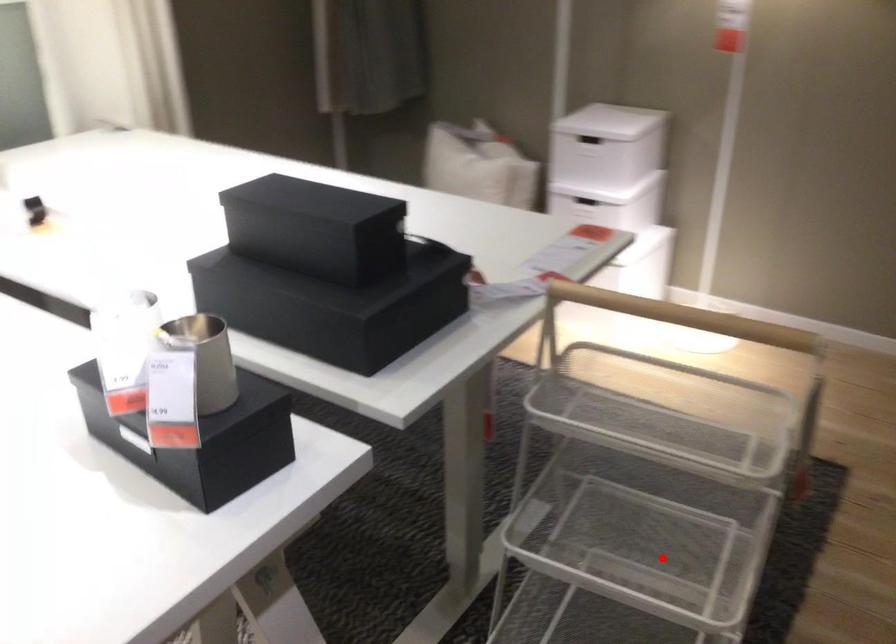
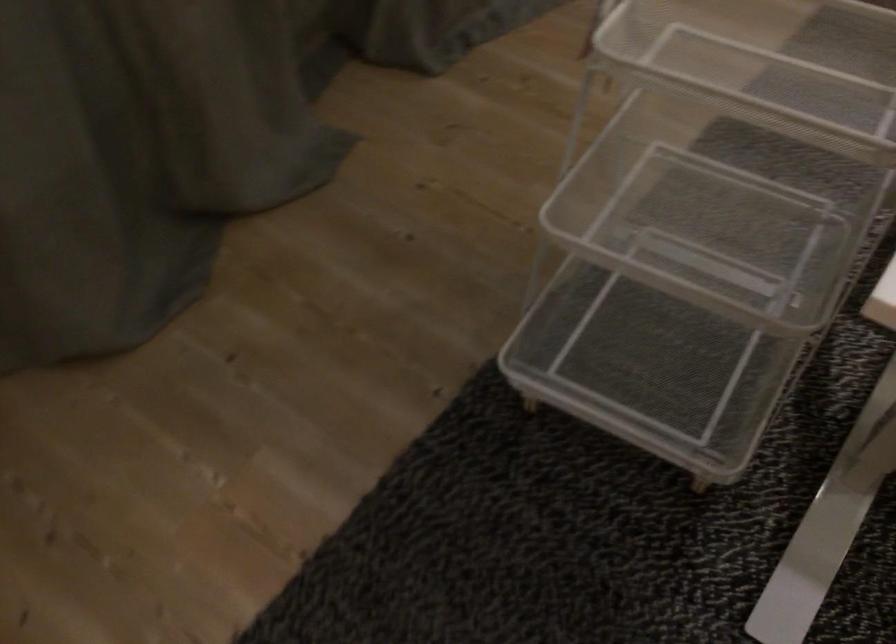
Question: I am providing you with two images of the same scene from different viewpoints. Image1 has a red point marked. In image2, the corresponding 3D location appears at what relative position? Reply with the corresponding letter.

Choices:
 (A) Closer
 (B) Farther

Answer: (A)